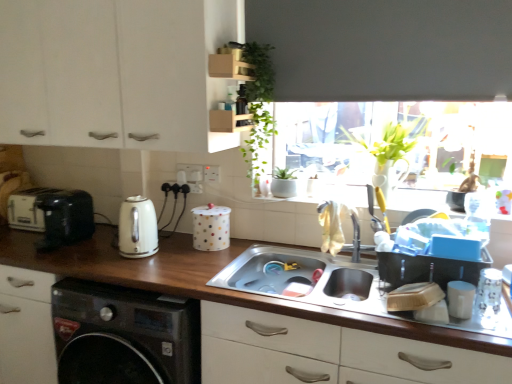
Question: From a real-world perspective, is white polka dot container at center, which is counted as the 2th appliance, starting from the right, over white matte cup at lower right, arranged as the 4th appliance when viewed from the left?

Choices:
 (A) no
 (B) yes

Answer: (B)

Question: Is white polka dot container at center, the third appliance from the left, facing towards white matte cup at lower right, the 1th appliance when ordered from right to left?

Choices:
 (A) no
 (B) yes

Answer: (A)

Question: Can white matte cup at lower right, the 1th appliance positioned from the front, be found inside white polka dot container at center, the third appliance from the left?

Choices:
 (A) yes
 (B) no

Answer: (B)

Question: Considering the relative sizes of white polka dot container at center, arranged as the second appliance when viewed from the back, and white matte cup at lower right, the 1th appliance positioned from the front, in the image provided, is white polka dot container at center, arranged as the second appliance when viewed from the back, shorter than white matte cup at lower right, the 1th appliance positioned from the front,?

Choices:
 (A) yes
 (B) no

Answer: (B)

Question: Is white polka dot container at center, the third appliance from the left, not close to white matte cup at lower right, arranged as the 4th appliance when viewed from the left?

Choices:
 (A) yes
 (B) no

Answer: (B)

Question: From the image's perspective, is white polka dot container at center, which is counted as the 2th appliance, starting from the right, under white matte cup at lower right, the 1th appliance positioned from the front?

Choices:
 (A) yes
 (B) no

Answer: (B)

Question: Can you confirm if wooden at lower center is thinner than green leafy plant at upper center?

Choices:
 (A) yes
 (B) no

Answer: (B)

Question: Is wooden at lower center bigger than green leafy plant at upper center?

Choices:
 (A) yes
 (B) no

Answer: (A)

Question: Is wooden at lower center oriented towards green leafy plant at upper center?

Choices:
 (A) yes
 (B) no

Answer: (B)

Question: Is wooden at lower center oriented away from green leafy plant at upper center?

Choices:
 (A) yes
 (B) no

Answer: (B)

Question: Is wooden at lower center positioned far away from green leafy plant at upper center?

Choices:
 (A) yes
 (B) no

Answer: (B)

Question: Can green leafy plant at upper center be found inside wooden at lower center?

Choices:
 (A) yes
 (B) no

Answer: (B)

Question: From a real-world perspective, is wooden at lower center over white matte cabinet at upper left?

Choices:
 (A) yes
 (B) no

Answer: (B)